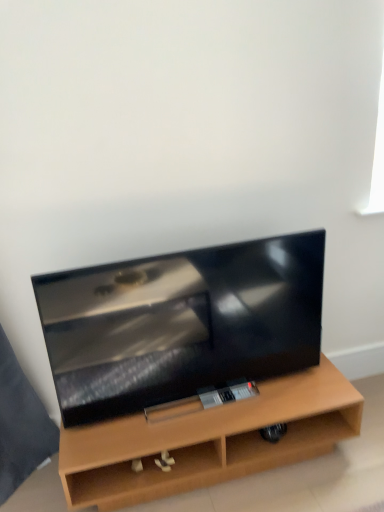
Question: Is matte black tv at center facing towards matte wood tv stand at center?

Choices:
 (A) no
 (B) yes

Answer: (A)

Question: From a real-world perspective, is matte black tv at center on matte wood tv stand at center?

Choices:
 (A) no
 (B) yes

Answer: (B)

Question: Is matte wood tv stand at center completely or partially inside matte black tv at center?

Choices:
 (A) no
 (B) yes

Answer: (A)

Question: Considering the relative sizes of matte black tv at center and matte wood tv stand at center in the image provided, is matte black tv at center wider than matte wood tv stand at center?

Choices:
 (A) yes
 (B) no

Answer: (B)

Question: From a real-world perspective, is matte black tv at center located beneath matte wood tv stand at center?

Choices:
 (A) no
 (B) yes

Answer: (A)

Question: Considering the relative sizes of matte black tv at center and matte wood tv stand at center in the image provided, is matte black tv at center shorter than matte wood tv stand at center?

Choices:
 (A) no
 (B) yes

Answer: (A)

Question: Is matte black tv at center a part of matte wood tv stand at center?

Choices:
 (A) no
 (B) yes

Answer: (A)

Question: Considering the relative sizes of matte wood tv stand at center and matte black tv at center in the image provided, is matte wood tv stand at center wider than matte black tv at center?

Choices:
 (A) no
 (B) yes

Answer: (B)

Question: Considering the relative sizes of matte wood tv stand at center and matte black tv at center in the image provided, is matte wood tv stand at center taller than matte black tv at center?

Choices:
 (A) no
 (B) yes

Answer: (A)

Question: Does matte wood tv stand at center lie behind matte black tv at center?

Choices:
 (A) no
 (B) yes

Answer: (B)

Question: From a real-world perspective, is matte wood tv stand at center physically above matte black tv at center?

Choices:
 (A) yes
 (B) no

Answer: (B)

Question: Is matte black tv at center at the back of matte wood tv stand at center?

Choices:
 (A) yes
 (B) no

Answer: (B)

Question: Considering the positions of point pos(72,421) and point pos(354,411), is point pos(72,421) closer or farther from the camera than point pos(354,411)?

Choices:
 (A) farther
 (B) closer

Answer: (B)